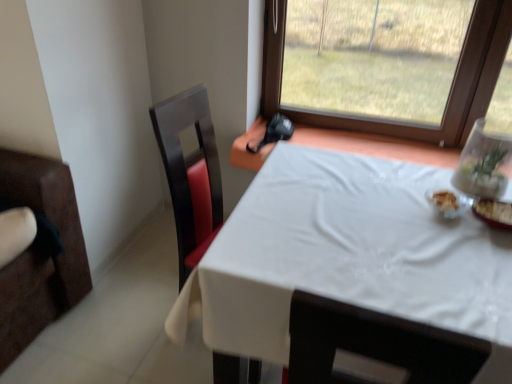
This screenshot has width=512, height=384. I want to click on free spot in front of white glossy bowl at upper right, so click(x=456, y=247).